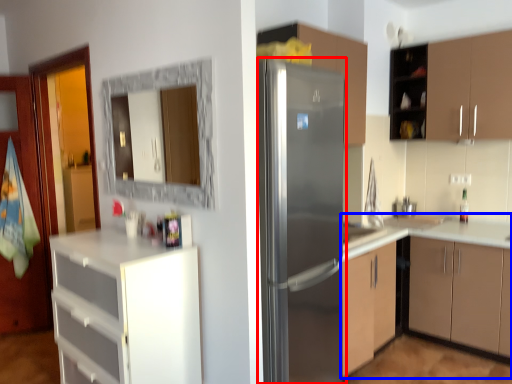
Question: Which object appears closest to the camera in this image, refrigerator (highlighted by a red box) or cabinetry (highlighted by a blue box)?

Choices:
 (A) refrigerator
 (B) cabinetry

Answer: (A)